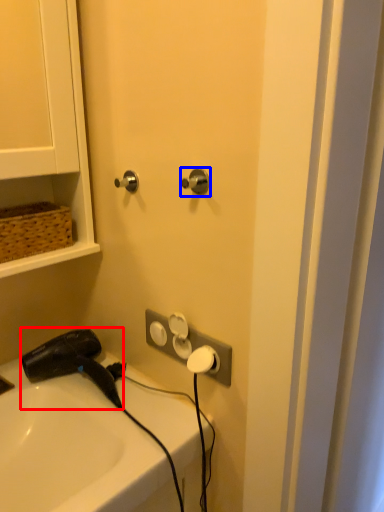
Question: Which point is further to the camera, hair drier (highlighted by a red box) or door handle (highlighted by a blue box)?

Choices:
 (A) hair drier
 (B) door handle

Answer: (A)